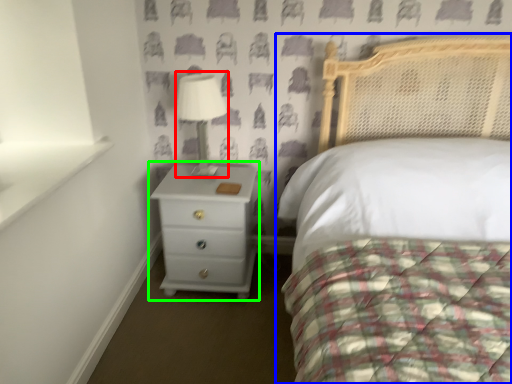
Question: Which object is positioned farthest from table lamp (highlighted by a red box)? Select from bed (highlighted by a blue box) and chest of drawers (highlighted by a green box).

Choices:
 (A) bed
 (B) chest of drawers

Answer: (A)